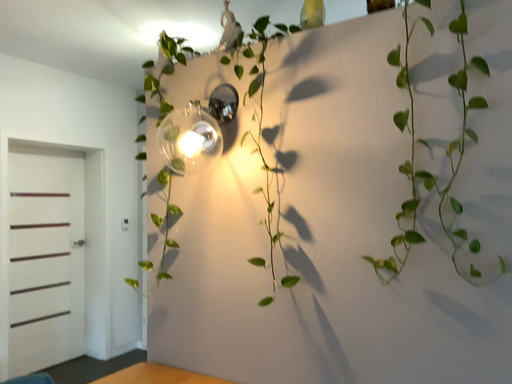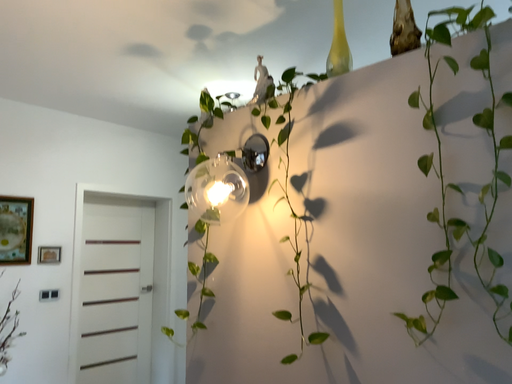
Question: How did the camera likely rotate when shooting the video?

Choices:
 (A) rotated left
 (B) rotated right

Answer: (A)